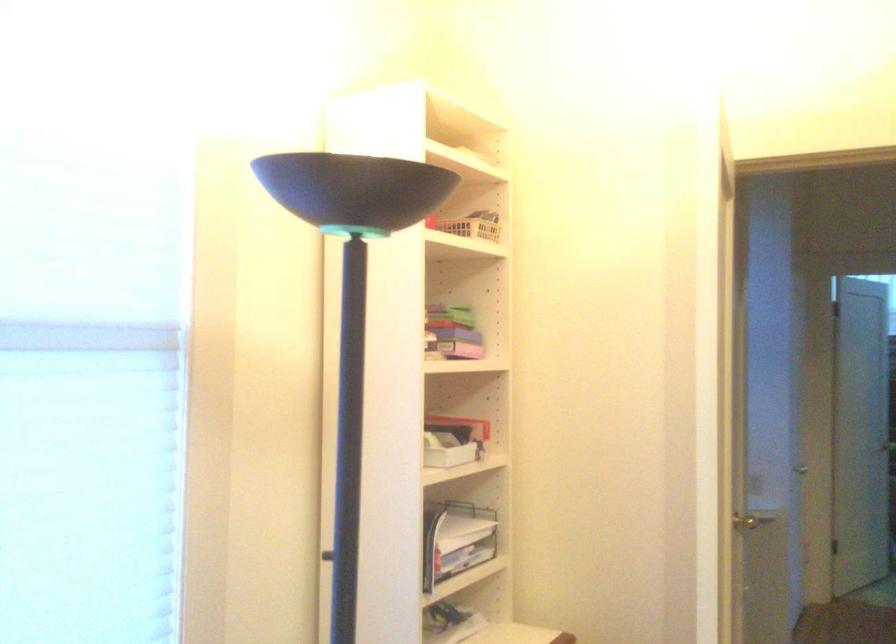
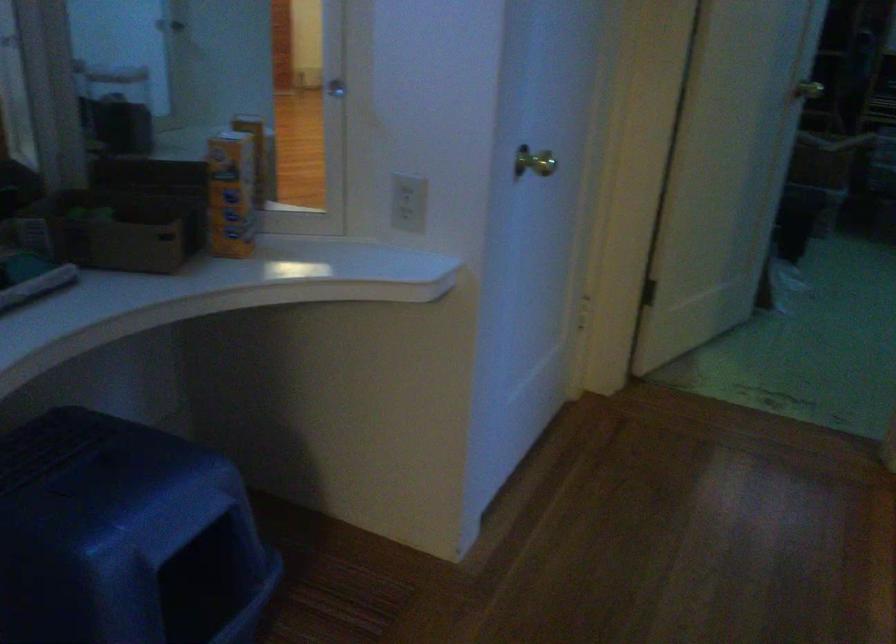
In the second image, find the point that corresponds to pixel 776 483 in the first image.

(409, 202)